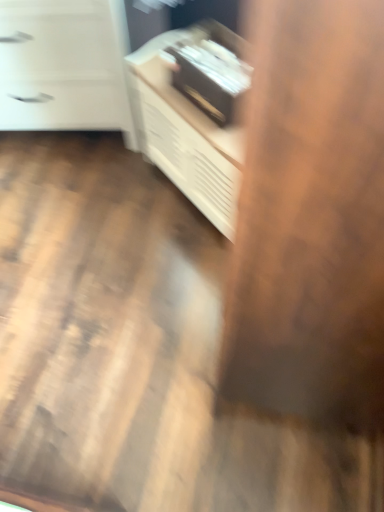
Question: Considering the relative sizes of white matte chest of drawers at upper left and white wood cabinet at upper center in the image provided, is white matte chest of drawers at upper left smaller than white wood cabinet at upper center?

Choices:
 (A) no
 (B) yes

Answer: (A)

Question: Is white matte chest of drawers at upper left facing towards white wood cabinet at upper center?

Choices:
 (A) no
 (B) yes

Answer: (A)

Question: Would you say white matte chest of drawers at upper left contains white wood cabinet at upper center?

Choices:
 (A) no
 (B) yes

Answer: (A)

Question: Is the position of white matte chest of drawers at upper left more distant than that of white wood cabinet at upper center?

Choices:
 (A) yes
 (B) no

Answer: (A)

Question: Is white matte chest of drawers at upper left located outside white wood cabinet at upper center?

Choices:
 (A) no
 (B) yes

Answer: (B)

Question: Does white matte chest of drawers at upper left lie in front of white wood cabinet at upper center?

Choices:
 (A) yes
 (B) no

Answer: (B)

Question: Is white wood cabinet at upper center turned away from white matte chest of drawers at upper left?

Choices:
 (A) yes
 (B) no

Answer: (B)

Question: Considering the relative sizes of white wood cabinet at upper center and white matte chest of drawers at upper left in the image provided, is white wood cabinet at upper center shorter than white matte chest of drawers at upper left?

Choices:
 (A) yes
 (B) no

Answer: (A)

Question: From a real-world perspective, is white wood cabinet at upper center on white matte chest of drawers at upper left?

Choices:
 (A) no
 (B) yes

Answer: (A)

Question: Is white wood cabinet at upper center located outside white matte chest of drawers at upper left?

Choices:
 (A) yes
 (B) no

Answer: (A)

Question: Is white wood cabinet at upper center at the right side of white matte chest of drawers at upper left?

Choices:
 (A) yes
 (B) no

Answer: (A)

Question: From the image's perspective, is white wood cabinet at upper center located beneath white matte chest of drawers at upper left?

Choices:
 (A) no
 (B) yes

Answer: (B)

Question: From their relative heights in the image, would you say white wood cabinet at upper center is taller or shorter than white matte chest of drawers at upper left?

Choices:
 (A) tall
 (B) short

Answer: (B)